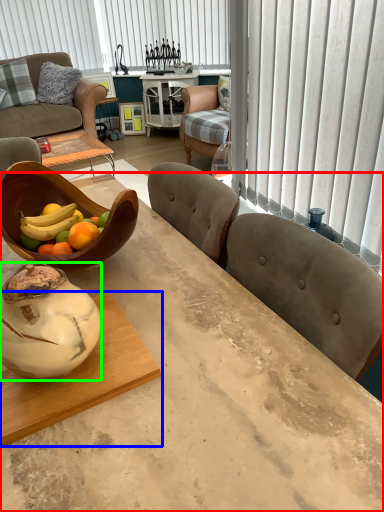
Question: Estimate the real-world distances between objects in this image. Which object is farther from desk (highlighted by a red box), coffee table (highlighted by a blue box) or vase (highlighted by a green box)?

Choices:
 (A) coffee table
 (B) vase

Answer: (B)